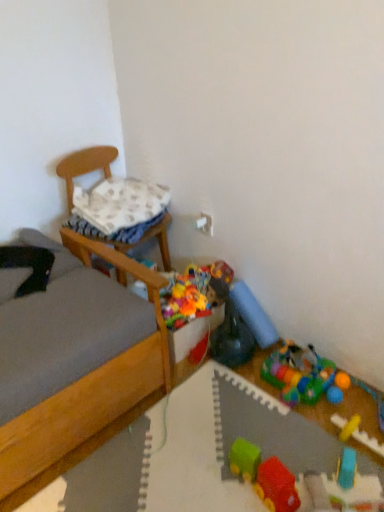
The height and width of the screenshot is (512, 384). Find the location of `free area in between rubberized plastic train at center, the 1th toy in the front-to-back sequence, and rubber duck at center, which is counted as the fifth toy, starting from the front`. free area in between rubberized plastic train at center, the 1th toy in the front-to-back sequence, and rubber duck at center, which is counted as the fifth toy, starting from the front is located at coordinates (252, 415).